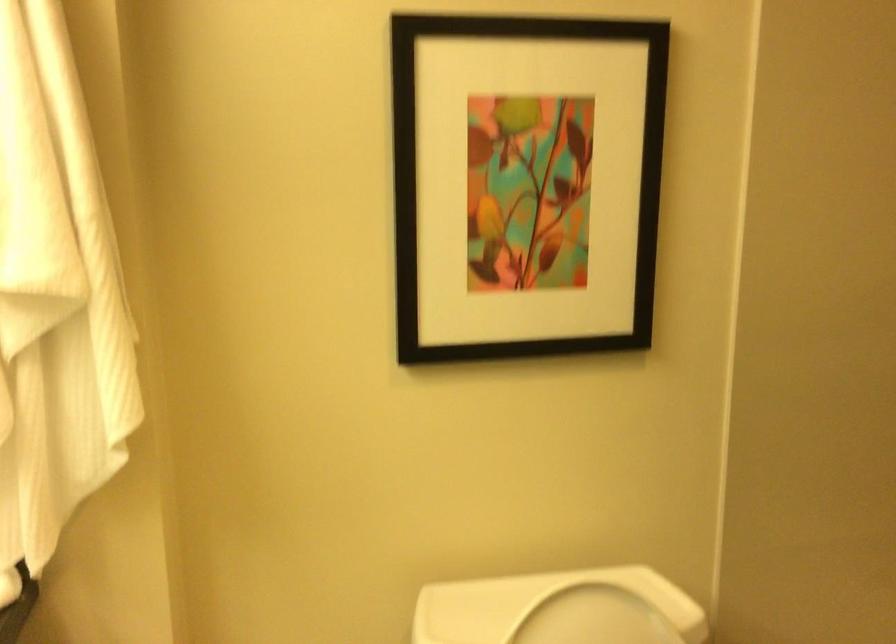
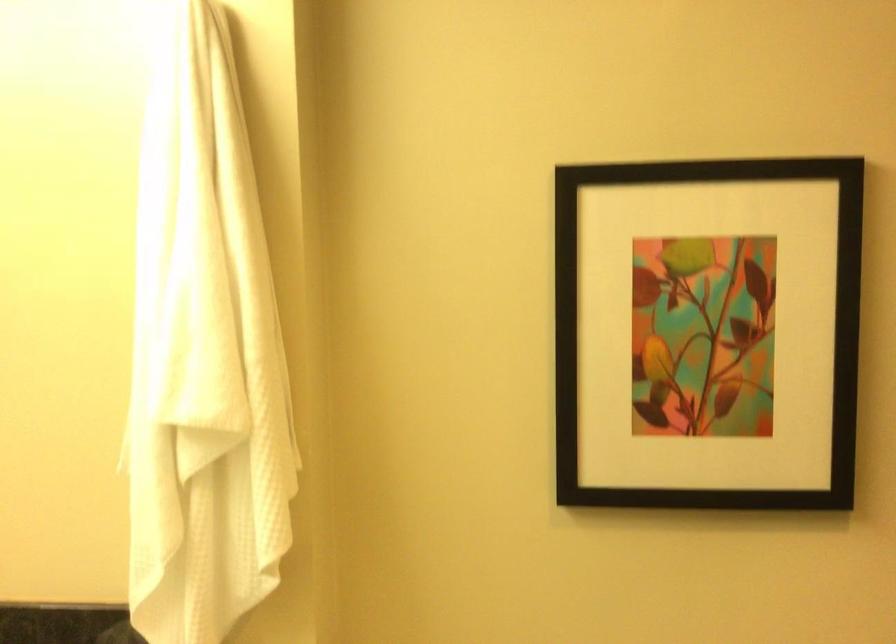
Locate, in the second image, the point that corresponds to pixel 533 194 in the first image.

(708, 333)